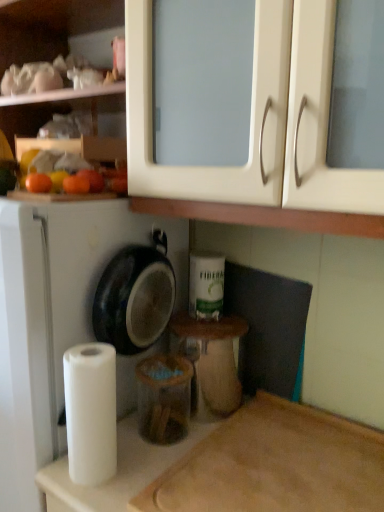
Where is `free location in front of orange matte at left, which ranks as the second orange in left-to-right order`? The width and height of the screenshot is (384, 512). free location in front of orange matte at left, which ranks as the second orange in left-to-right order is located at coordinates (x=54, y=198).